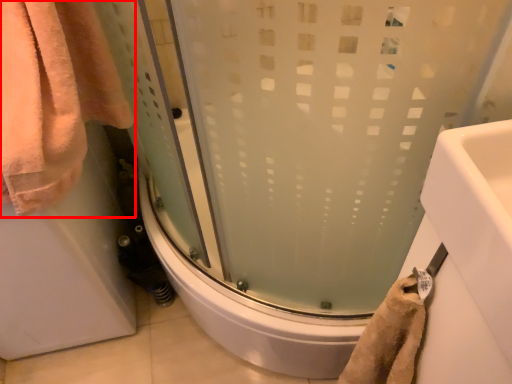
Question: Where is towel (annotated by the red box) located in relation to shower door in the image?

Choices:
 (A) right
 (B) left

Answer: (B)